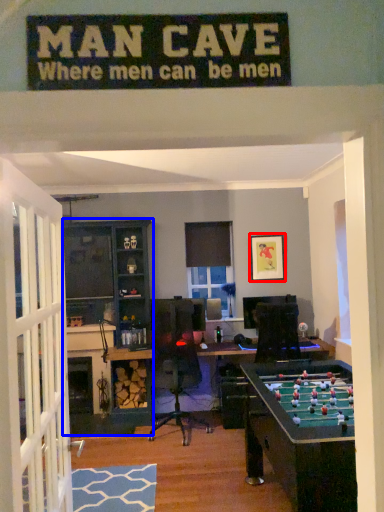
Question: Among these objects, which one is nearest to the camera, picture frame (highlighted by a red box) or entertainment center (highlighted by a blue box)?

Choices:
 (A) picture frame
 (B) entertainment center

Answer: (B)